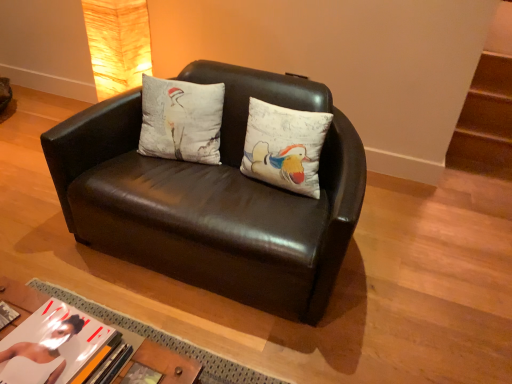
Identify the location of vacant area on top of matte paper book at lower left, which is the second book in right-to-left order (from a real-world perspective). (48, 345).